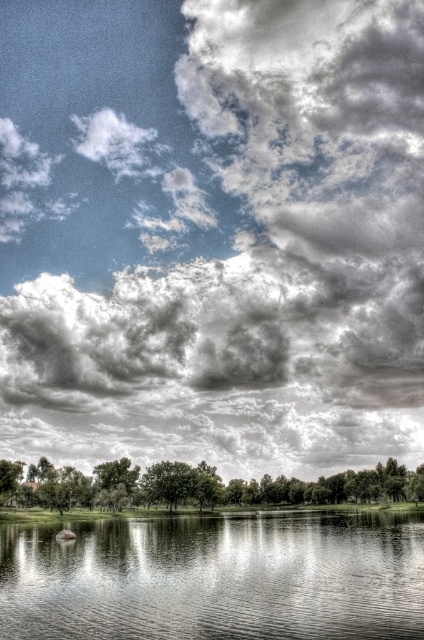
Question: Can you confirm if cloudy sky at upper center is positioned to the left of green leafy tree at center?

Choices:
 (A) yes
 (B) no

Answer: (A)

Question: Which point appears farthest from the camera in this image?

Choices:
 (A) (254, 64)
 (B) (390, 561)

Answer: (A)

Question: Where is transparent water at center located in relation to green leafy tree at center in the image?

Choices:
 (A) below
 (B) above

Answer: (B)

Question: Which of the following is the closest to the observer?

Choices:
 (A) green leafy tree at center
 (B) cloudy sky at upper center
 (C) transparent water at center

Answer: (C)

Question: Which object appears closest to the camera in this image?

Choices:
 (A) cloudy sky at upper center
 (B) transparent water at center

Answer: (B)

Question: Is cloudy sky at upper center positioned in front of green leafy tree at center?

Choices:
 (A) no
 (B) yes

Answer: (A)